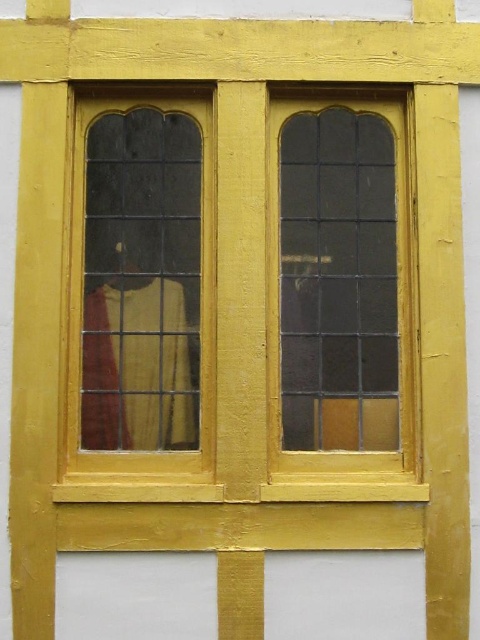
You are an architect inspecting the building facade. You notice the stained glass window at center and the clear glass window at left. Which window is located higher up on the wall?

The stained glass window at center is positioned over the clear glass window at left, meaning it is higher up on the wall.

You are an architect evaluating the building facade. You need to install a new air conditioning unit that requires a minimum height of 1.5 meters. Which window, the stained glass window at center or the clear glass window at left, would be suitable for this installation based on their heights?

The stained glass window at center is much taller than the clear glass window at left, so it would be suitable for installing the new air conditioning unit requiring a minimum height of 1.5 meters.

You are standing in front of the building and see two points marked on the wall. The first point is at coordinate point (377, 131) and the second is at point (103, 444). Which point is closer to you?

Point (103, 444) is closer to you because it is less further to the camera than point (377, 131).